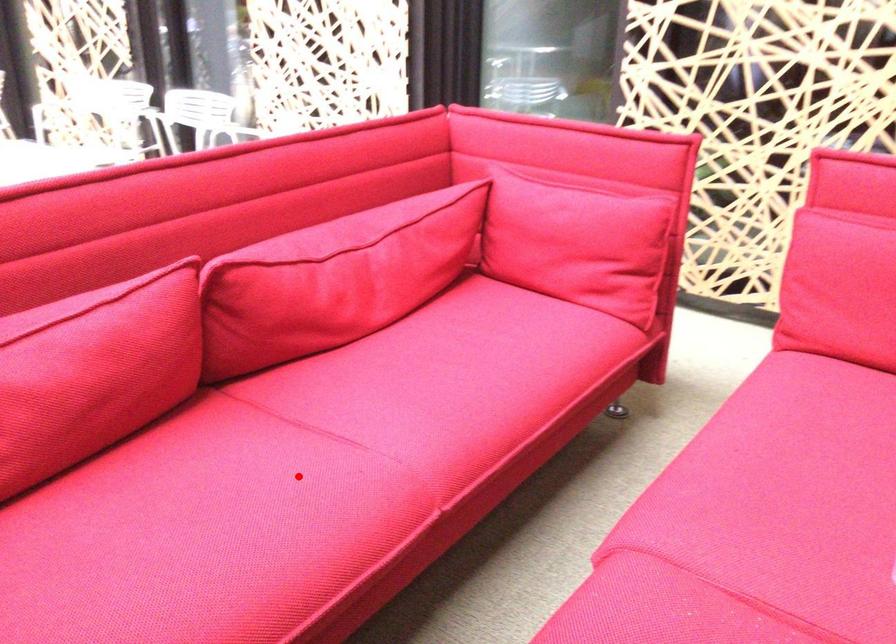
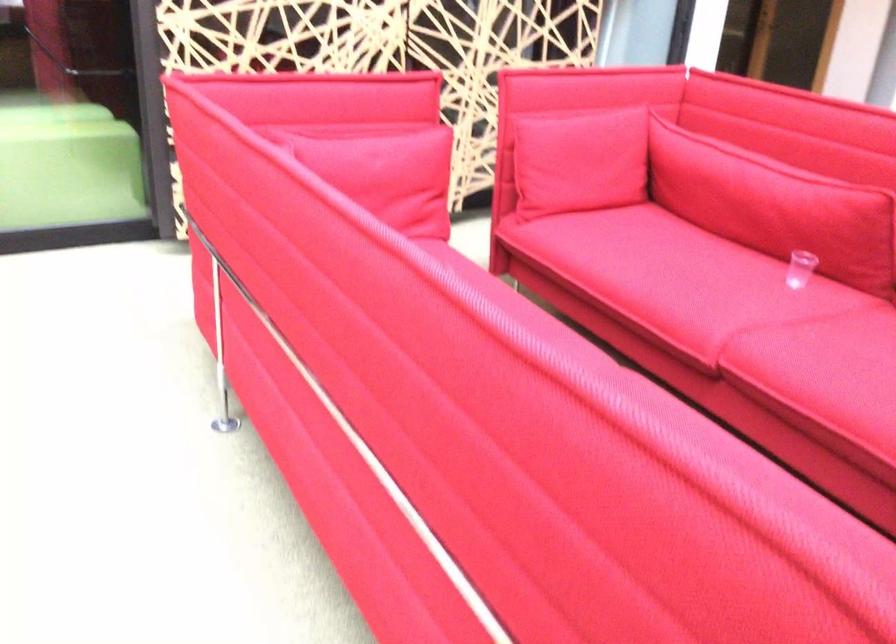
Question: I am providing you with two images of the same scene from different viewpoints. A red point is marked on the first image. Can you still see the location of the red point in image 2?

Choices:
 (A) Yes
 (B) No

Answer: (B)